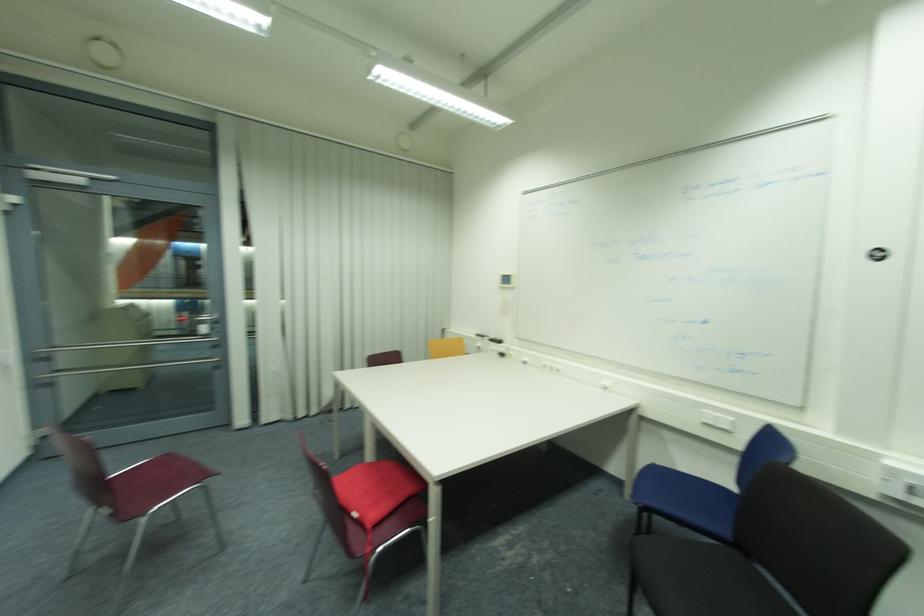
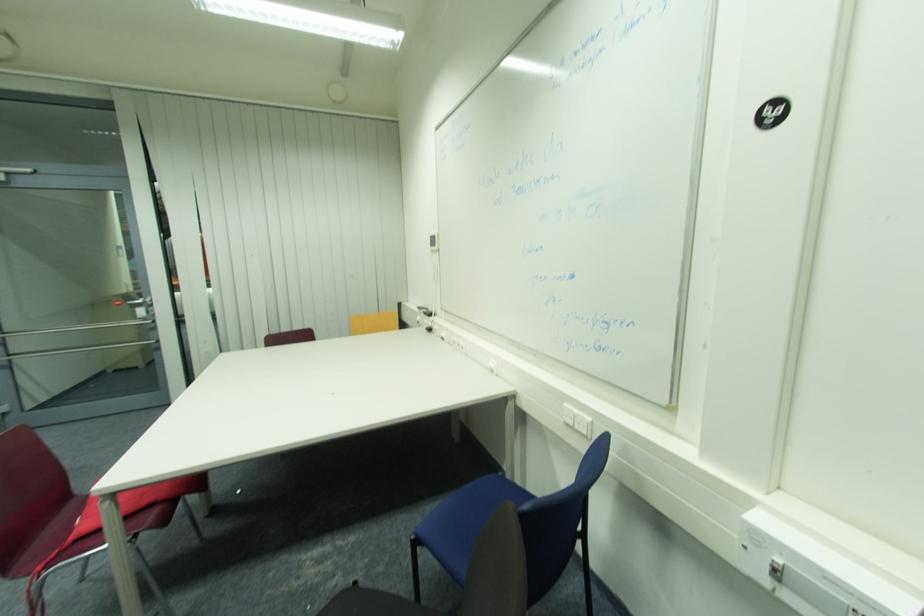
In a continuous first-person perspective shot, in which direction is the camera moving?

The movement direction of the cameraman is right, forward.